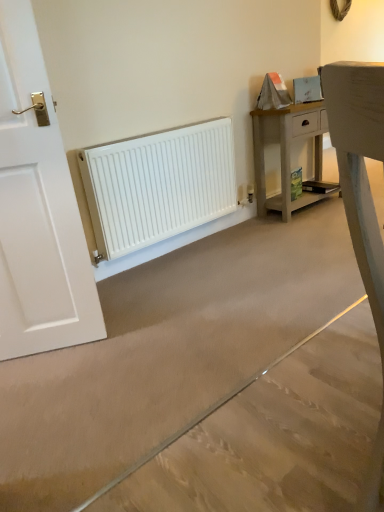
At what (x,y) coordinates should I click in order to perform the action: click on vacant space underneath white matte radiator at lower left (from a real-world perspective). Please return your answer as a coordinate pair (x, y). The width and height of the screenshot is (384, 512). Looking at the image, I should click on (180, 249).